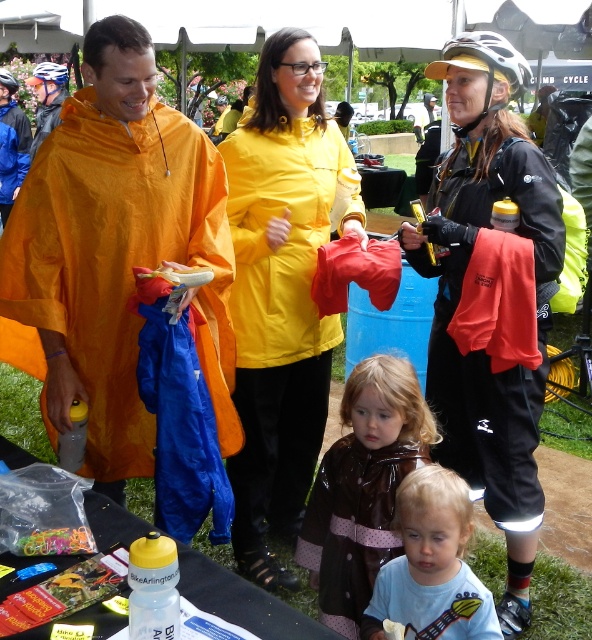
In the scene shown: Is the position of yellow waterproof jacket at center more distant than that of blue cotton shirt at lower center?

That is True.

Is point (260, 524) farther from viewer compared to point (424, 636)?

That is True.

Where is `yellow waterproof jacket at center`? This screenshot has width=592, height=640. yellow waterproof jacket at center is located at coordinates (279, 296).

Can you confirm if orange waterproof poncho at left is shorter than brown shiny raincoat at center?

In fact, orange waterproof poncho at left may be taller than brown shiny raincoat at center.

Between point (46, 321) and point (392, 438), which one is positioned behind?

Positioned behind is point (392, 438).

Which is behind, point (197, 166) or point (388, 552)?

Positioned behind is point (197, 166).

Locate an element on the screen. orange waterproof poncho at left is located at coordinates (118, 252).

Does black matte jacket at right appear under yellow waterproof jacket at center?

Yes.

From the picture: Does black matte jacket at right have a lesser height compared to yellow waterproof jacket at center?

In fact, black matte jacket at right may be taller than yellow waterproof jacket at center.

The image size is (592, 640). Identify the location of black matte jacket at right. (490, 298).